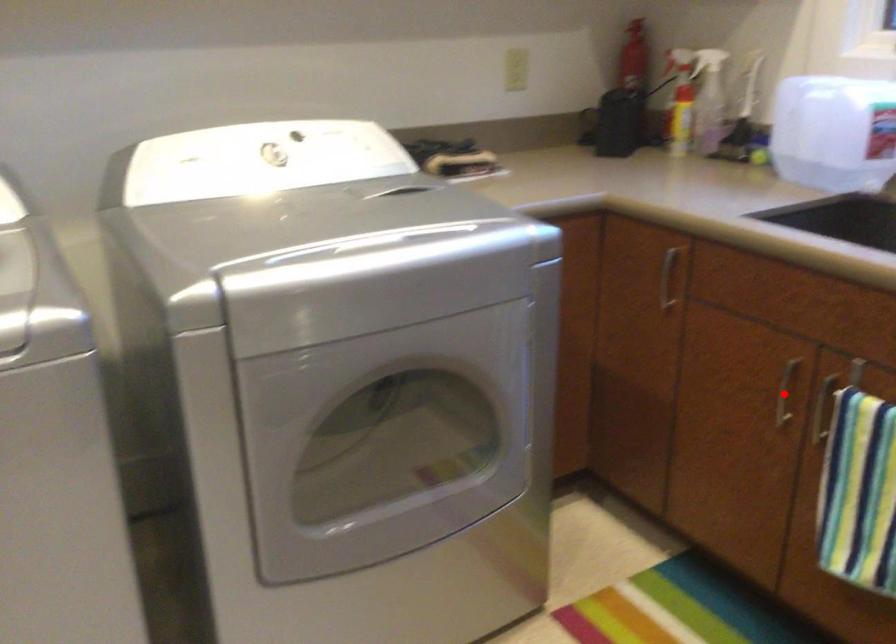
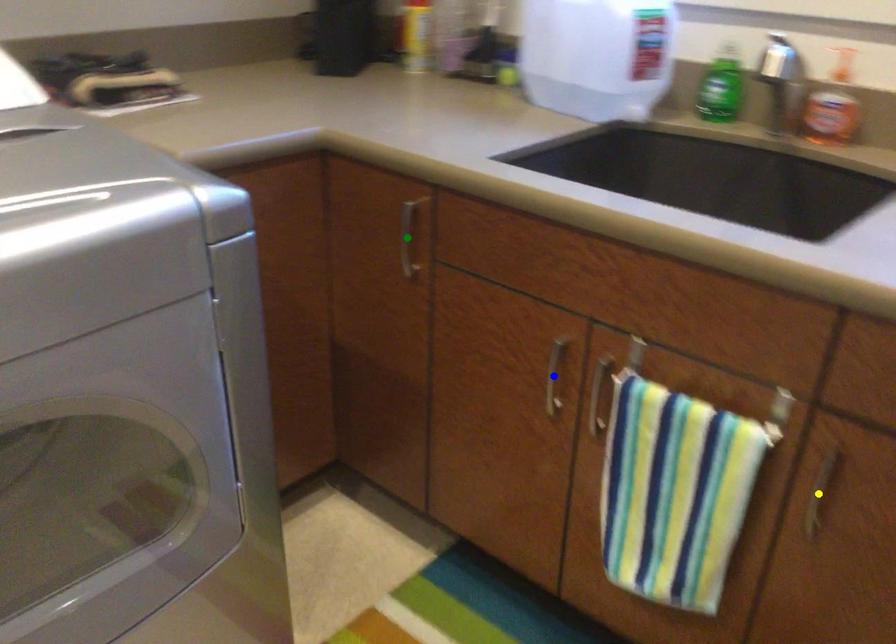
Question: I am providing you with two images of the same scene from different viewpoints. A red point is marked on the first image. You are given multiple points on the second image. Which point in image 2 represents the same 3d spot as the red point in image 1?

Choices:
 (A) green point
 (B) blue point
 (C) yellow point

Answer: (B)